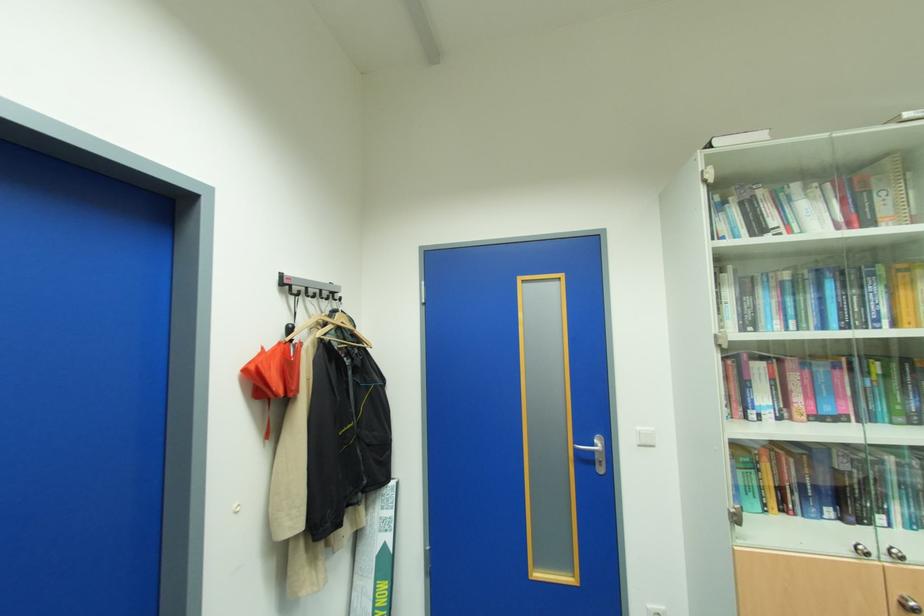
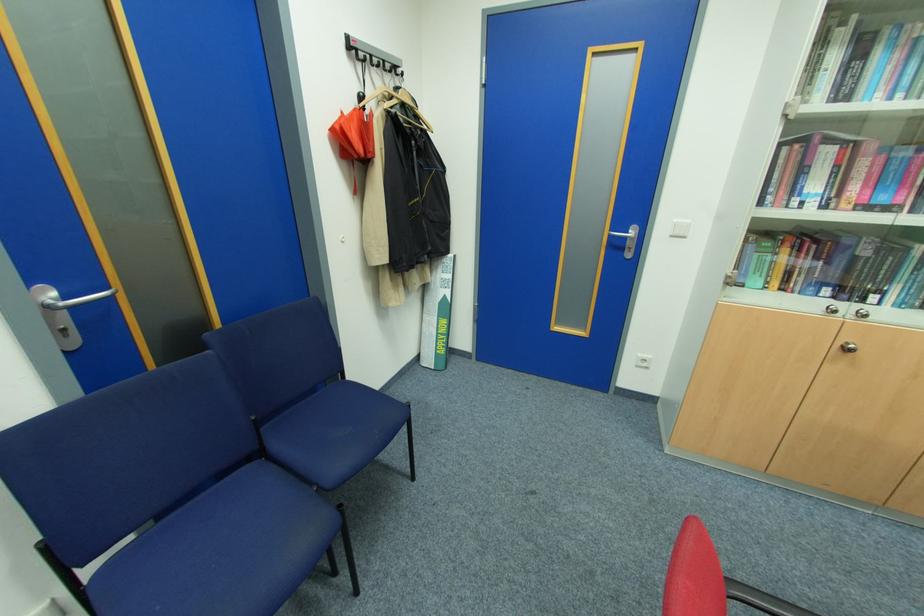
In the second image, find the point that corresponds to pixel 857 549 in the first image.

(830, 310)